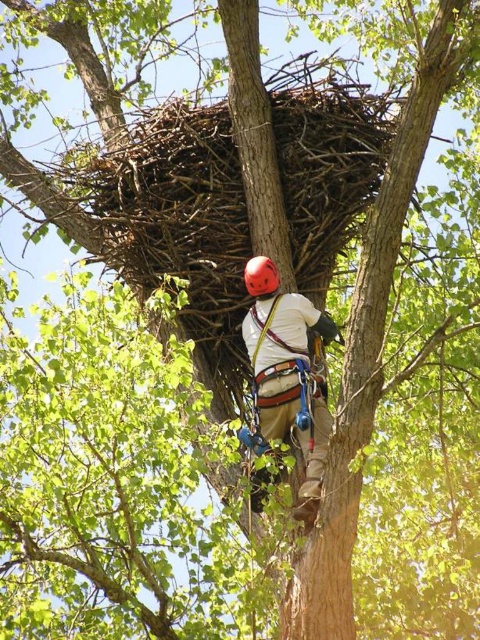
Who is lower down, white fabric safety vest at center or matte red helmet at center?

Positioned lower is white fabric safety vest at center.

Can you confirm if white fabric safety vest at center is thinner than matte red helmet at center?

In fact, white fabric safety vest at center might be wider than matte red helmet at center.

Is point (252, 337) in front of point (276, 282)?

No, it is not.

At what (x,y) coordinates should I click in order to perform the action: click on white fabric safety vest at center. Please return your answer as a coordinate pair (x, y). This screenshot has width=480, height=640. Looking at the image, I should click on (287, 332).

Is matte white helmet at center shorter than matte red helmet at center?

In fact, matte white helmet at center may be taller than matte red helmet at center.

Who is more forward, (312, 417) or (261, 278)?

Point (312, 417) is more forward.

This screenshot has height=640, width=480. I want to click on matte white helmet at center, so [288, 372].

Who is more distant from viewer, [315,374] or [254,337]?

The point [254,337] is more distant.

Looking at this image, is matte white helmet at center thinner than white fabric safety vest at center?

In fact, matte white helmet at center might be wider than white fabric safety vest at center.

Image resolution: width=480 pixels, height=640 pixels. In order to click on matte white helmet at center in this screenshot , I will do `click(288, 372)`.